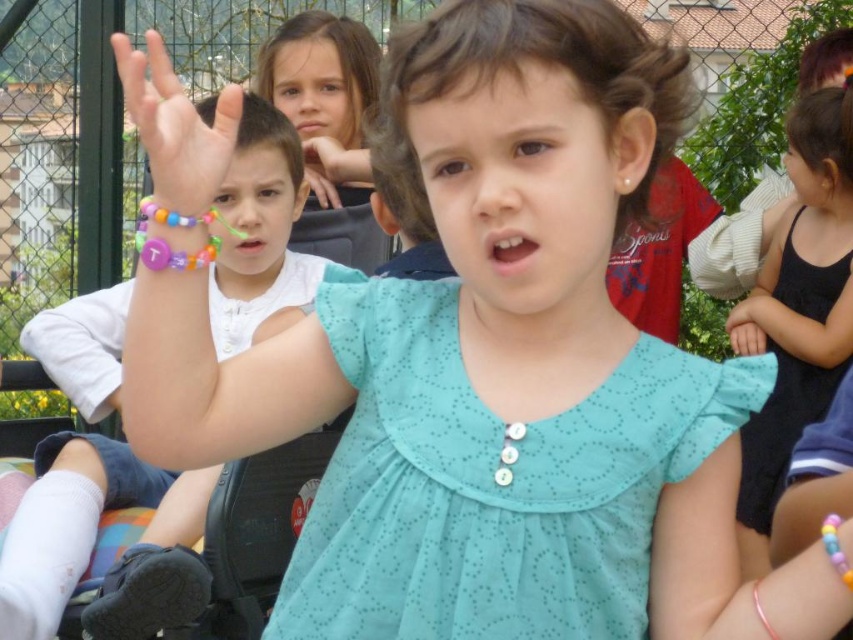
Question: Can you confirm if white fabric shirt at left is positioned to the right of matte brown hair at upper center?

Choices:
 (A) no
 (B) yes

Answer: (A)

Question: Which object appears closest to the camera in this image?

Choices:
 (A) matte brown hair at upper center
 (B) white fabric shirt at left
 (C) multicolored beaded bracelet at center
 (D) smooth skin face at center

Answer: (C)

Question: Does white fabric shirt at left appear on the right side of matte plastic face at center?

Choices:
 (A) no
 (B) yes

Answer: (A)

Question: Which is nearer to the teal fabric face at center?

Choices:
 (A) multicolored beaded bracelet at center
 (B) smooth skin face at upper center
 (C) white fabric shirt at left
 (D) matte plastic face at center

Answer: (A)

Question: Estimate the real-world distances between objects in this image. Which object is closer to the multicolored beaded bracelet at center?

Choices:
 (A) matte plastic face at center
 (B) smooth skin face at upper center

Answer: (A)

Question: Does white fabric shirt at left come behind matte plastic face at center?

Choices:
 (A) yes
 (B) no

Answer: (B)